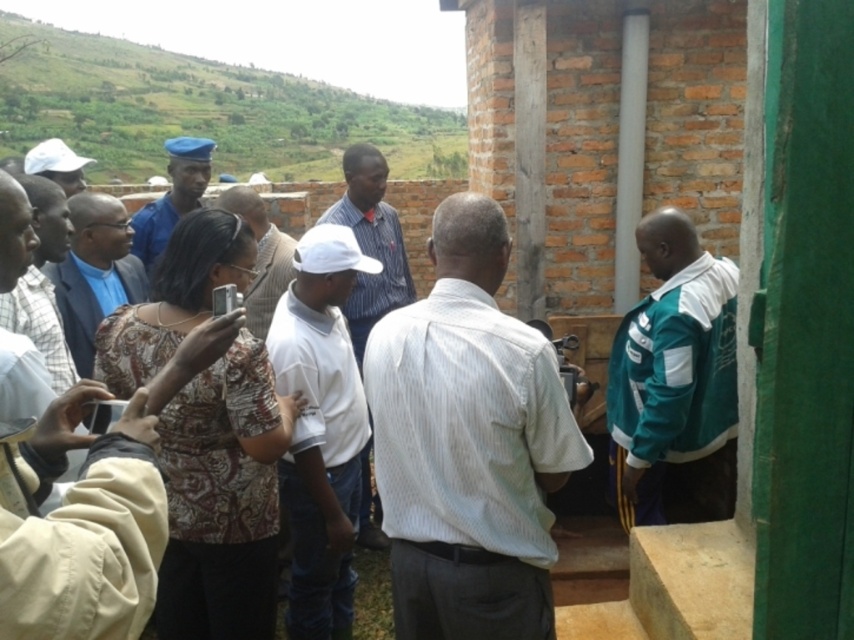
Based on the photo, what is located at the coordinates point (370, 243) in the image?

The striped shirt at center is located at point (370, 243).

Where is the white matte shirt at center located in the image?

The white matte shirt at center is located at point 0.672 on the x axis and 0.376 on the y axis.